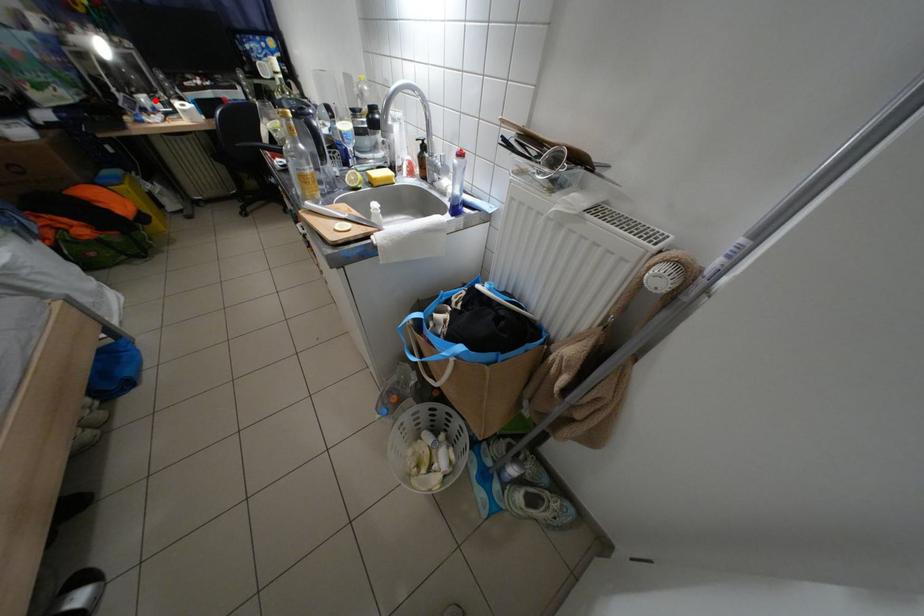
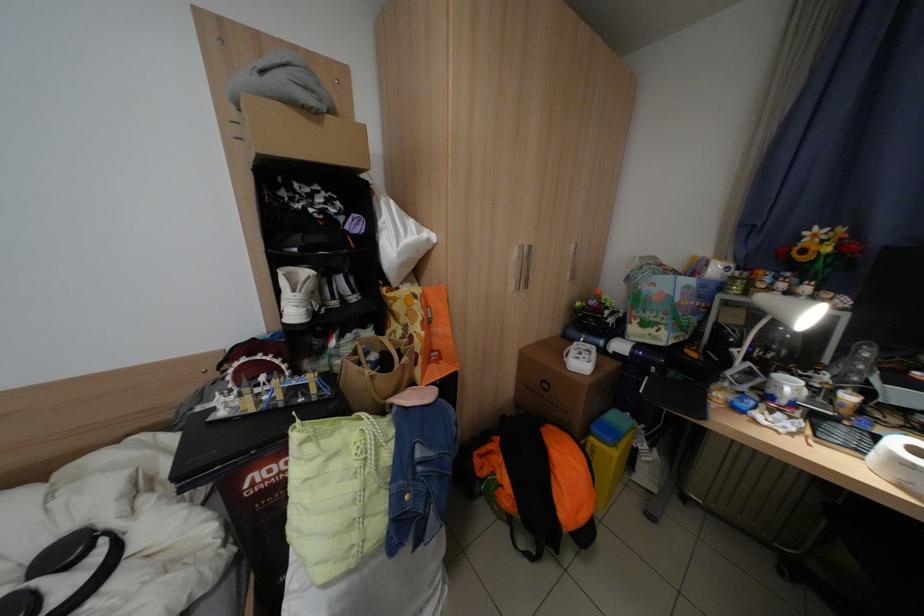
Question: I am providing you with two images of the same scene from different viewpoints. A red point is shown in image1. For the corresponding object point in image2, is it positioned nearer or farther from the camera?

Choices:
 (A) Nearer
 (B) Farther

Answer: (A)